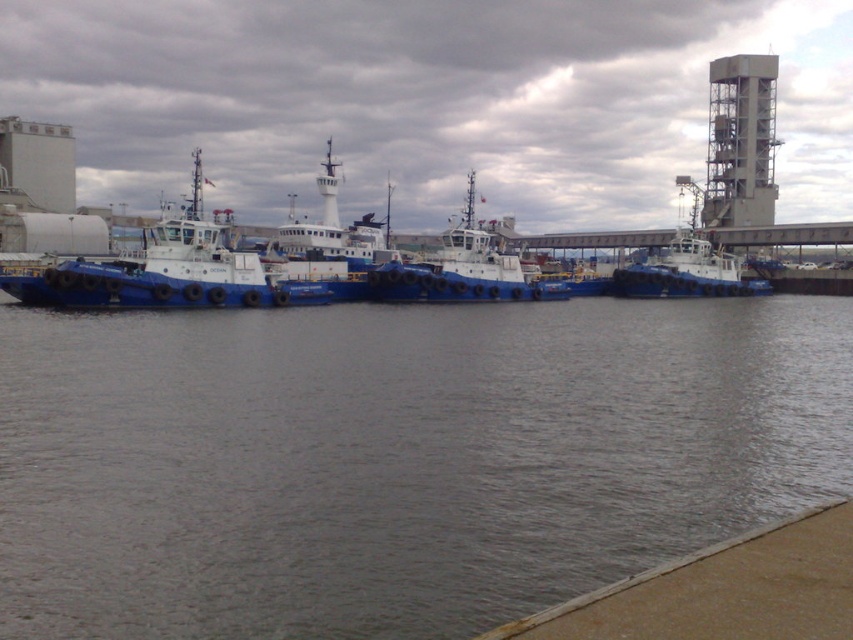
Between blue rubber boat at center and blue rubber boat at right, which one appears on the left side from the viewer's perspective?

blue rubber boat at center

Is blue rubber boat at center below blue rubber boat at right?

Indeed, blue rubber boat at center is positioned under blue rubber boat at right.

Is point (242, 588) closer to viewer compared to point (631, 275)?

Yes, point (242, 588) is closer to viewer.

Locate an element on the screen. The image size is (853, 640). blue rubber boat at center is located at coordinates (395, 458).

From the picture: Can you confirm if blue rubber boat at left is positioned to the left of blue rubber boat at right?

Indeed, blue rubber boat at left is positioned on the left side of blue rubber boat at right.

Does blue rubber boat at left come behind blue rubber boat at right?

That is False.

Describe the element at coordinates (167, 272) in the screenshot. I see `blue rubber boat at left` at that location.

Where is `blue rubber boat at left`? blue rubber boat at left is located at coordinates (167, 272).

Which is behind, point (804, 300) or point (198, 268)?

Point (804, 300)

The image size is (853, 640). Find the location of `blue rubber boat at center`. blue rubber boat at center is located at coordinates (395, 458).